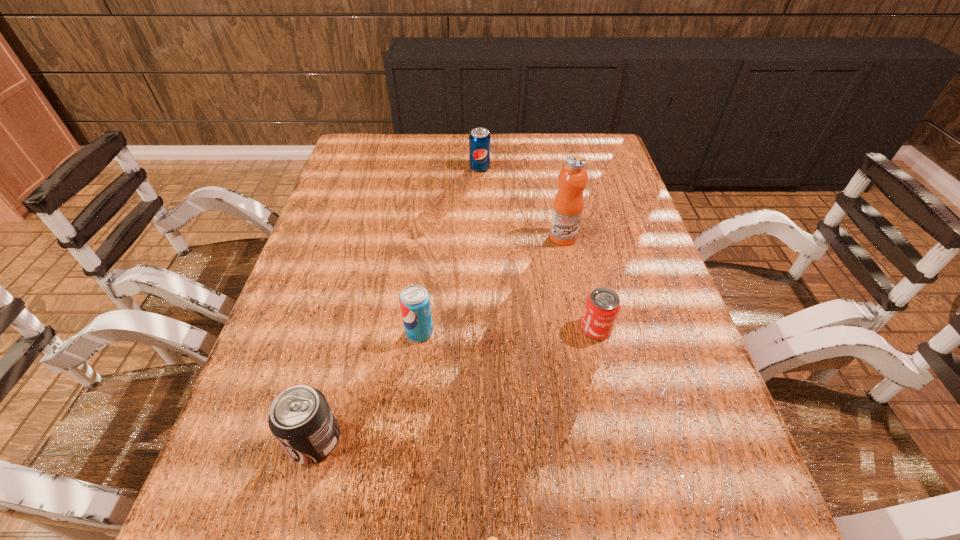
Locate an element on the screen. The width and height of the screenshot is (960, 540). free spot at the far left corner of the desktop is located at coordinates (363, 168).

Find the location of `vacant space in between the can and the farthest soda can`. vacant space in between the can and the farthest soda can is located at coordinates (538, 248).

Where is `empty space between the nearest soda can and the tallest object`? empty space between the nearest soda can and the tallest object is located at coordinates (439, 339).

This screenshot has width=960, height=540. Find the location of `vacant space that is in between the second farthest object and the farthest soda can`. vacant space that is in between the second farthest object and the farthest soda can is located at coordinates (521, 202).

Identify the location of blank region between the fifth tallest object and the second farthest soda can. The width and height of the screenshot is (960, 540). (508, 330).

The width and height of the screenshot is (960, 540). In order to click on empty location between the fifth object from right to left and the farthest soda can in this screenshot , I will do `click(449, 250)`.

Find the location of a particular element. The image size is (960, 540). object that stands as the closest to the nearest object is located at coordinates [x=300, y=418].

Locate an element on the screen. object that can be found as the third closest to the Lego is located at coordinates (602, 307).

This screenshot has height=540, width=960. Find the location of `soda can that can be found as the third closest to the fifth nearest object`. soda can that can be found as the third closest to the fifth nearest object is located at coordinates (300, 418).

Point out which soda can is positioned as the nearest to the rightmost soda can. Please provide its 2D coordinates. Your answer should be formatted as a tuple, i.e. [(x, y)], where the tuple contains the x and y coordinates of a point satisfying the conditions above.

[(414, 300)]